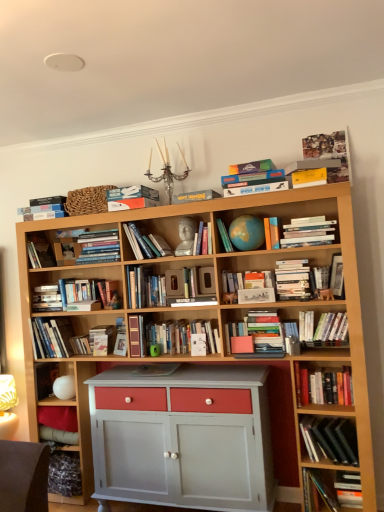
The image size is (384, 512). What do you see at coordinates (257, 335) in the screenshot?
I see `hardcover books at center, which is counted as the eighth book, starting from the left` at bounding box center [257, 335].

This screenshot has width=384, height=512. What do you see at coordinates (308, 233) in the screenshot? I see `hardcover books at upper center, the 4th book viewed from the right` at bounding box center [308, 233].

Measure the distance between hardcover book at lower right, which is the 13th book in left-to-right order, and camera.

hardcover book at lower right, which is the 13th book in left-to-right order, and camera are 8.03 feet apart.

Describe the element at coordinates (252, 167) in the screenshot. The width and height of the screenshot is (384, 512). I see `hardcover book at upper center, placed as the 4th paperback book when sorted from bottom to top` at that location.

Describe the element at coordinates (272, 233) in the screenshot. I see `hardcover book at upper center, the 9th book in the left-to-right sequence` at that location.

This screenshot has width=384, height=512. Identify the location of hardcover books at center, which is counted as the eighth book, starting from the left. (257, 335).

Is hardcover book at upper center, the 9th book in the left-to-right sequence, positioned behind hardcover books at upper center, the tenth book viewed from the left?

Yes, it is.

In terms of size, does hardcover book at upper center, the 9th book in the left-to-right sequence, appear bigger or smaller than hardcover books at upper center, the tenth book viewed from the left?

Considering their sizes, hardcover book at upper center, the 9th book in the left-to-right sequence, takes up less space than hardcover books at upper center, the tenth book viewed from the left.

From the image's perspective, is hardcover book at upper center, the fifth book in the right-to-left sequence, beneath hardcover books at upper center, the tenth book viewed from the left?

Yes, from the image's perspective, hardcover book at upper center, the fifth book in the right-to-left sequence, is beneath hardcover books at upper center, the tenth book viewed from the left.

From the image's perspective, between yellow matte paperback book at upper right, which is the 4th paperback book in left-to-right order, and white matte paperback book at center-right, the second paperback book positioned from the right, who is located below?

white matte paperback book at center-right, the second paperback book positioned from the right, is shown below in the image.

How different are the orientations of yellow matte paperback book at upper right, acting as the second paperback book starting from the top, and white matte paperback book at center-right, the second paperback book positioned from the right, in degrees?

The angle between the facing direction of yellow matte paperback book at upper right, acting as the second paperback book starting from the top, and the facing direction of white matte paperback book at center-right, the second paperback book positioned from the right, is 1.63 degrees.

From a real-world perspective, does yellow matte paperback book at upper right, acting as the second paperback book starting from the top, sit lower than white matte paperback book at center-right, the third paperback book in the left-to-right sequence?

Actually, yellow matte paperback book at upper right, acting as the second paperback book starting from the top, is physically above white matte paperback book at center-right, the third paperback book in the left-to-right sequence, in the real world.

Locate an element on the screen. The width and height of the screenshot is (384, 512). the 2nd paperback book in front of the white matte paperback book at center-right, which is counted as the fourth paperback book, starting from the top is located at coordinates (309, 177).

How distant is yellow matte paperback book at upper right, acting as the third paperback book starting from the bottom, from hardcover book at lower right, the first book positioned from the right?

yellow matte paperback book at upper right, acting as the third paperback book starting from the bottom, and hardcover book at lower right, the first book positioned from the right, are 5.96 feet apart.

Considering the sizes of yellow matte paperback book at upper right, the first paperback book viewed from the right, and hardcover book at lower right, the first book positioned from the right, in the image, is yellow matte paperback book at upper right, the first paperback book viewed from the right, taller or shorter than hardcover book at lower right, the first book positioned from the right,?

yellow matte paperback book at upper right, the first paperback book viewed from the right, is shorter than hardcover book at lower right, the first book positioned from the right.

From a real-world perspective, is yellow matte paperback book at upper right, the first paperback book viewed from the right, physically located above or below hardcover book at lower right, the first book positioned from the right?

In terms of real-world spatial position, yellow matte paperback book at upper right, the first paperback book viewed from the right, is above hardcover book at lower right, the first book positioned from the right.

Consider the image. From the image's perspective, is yellow matte paperback book at upper right, acting as the second paperback book starting from the top, positioned above or below hardcover book at lower right, the first book positioned from the right?

From the image's perspective, yellow matte paperback book at upper right, acting as the second paperback book starting from the top, appears above hardcover book at lower right, the first book positioned from the right.

Which point is more forward, (303, 386) or (238, 169)?

The point (303, 386) is closer.

Who is shorter, hardcover books at center, the 11th book from the left, or hardcover book at upper center, acting as the 3th paperback book starting from the right?

Standing shorter between the two is hardcover book at upper center, acting as the 3th paperback book starting from the right.

Between point (102, 230) and point (287, 284), which one is positioned in front?

The point (287, 284) is in front.

Is hardcover books at center, which is counted as the 4th book, starting from the left, bigger than white matte paperback book at center-right, which is counted as the fourth paperback book, starting from the top?

Indeed, hardcover books at center, which is counted as the 4th book, starting from the left, has a larger size compared to white matte paperback book at center-right, which is counted as the fourth paperback book, starting from the top.

From the image's perspective, would you say hardcover books at center, the tenth book when ordered from right to left, is shown under white matte paperback book at center-right, the second paperback book positioned from the right?

Actually, hardcover books at center, the tenth book when ordered from right to left, appears above white matte paperback book at center-right, the second paperback book positioned from the right, in the image.

Can you confirm if hardcover books at center, which is counted as the 4th book, starting from the left, is taller than white matte paperback book at center-right, which is counted as the fourth paperback book, starting from the top?

No, hardcover books at center, which is counted as the 4th book, starting from the left, is not taller than white matte paperback book at center-right, which is counted as the fourth paperback book, starting from the top.

Is hardcover books at center, arranged as the sixth book when viewed from the right, facing towards hardcover book at left, placed as the thirteenth book when sorted from right to left?

No, hardcover books at center, arranged as the sixth book when viewed from the right, does not turn towards hardcover book at left, placed as the thirteenth book when sorted from right to left.

Does point (277, 336) come closer to viewer compared to point (33, 251)?

Yes, it is in front of point (33, 251).

Between hardcover books at center, arranged as the sixth book when viewed from the right, and hardcover book at left, which is the first book from left to right, which one appears on the left side from the viewer's perspective?

hardcover book at left, which is the first book from left to right.

In the scene shown: Is hardcover book at upper center, the 9th book in the left-to-right sequence, located outside black matte book at lower right, the second book positioned from the right?

Yes, hardcover book at upper center, the 9th book in the left-to-right sequence, is outside of black matte book at lower right, the second book positioned from the right.

From the picture: Is hardcover book at upper center, the fifth book in the right-to-left sequence, beside black matte book at lower right, the second book positioned from the right?

No, hardcover book at upper center, the fifth book in the right-to-left sequence, is not making contact with black matte book at lower right, the second book positioned from the right.

Is hardcover book at upper center, the fifth book in the right-to-left sequence, turned away from black matte book at lower right, the second book positioned from the right?

No, hardcover book at upper center, the fifth book in the right-to-left sequence, is not facing the opposite direction of black matte book at lower right, the second book positioned from the right.

Between hardcover book at upper center, the fifth book in the right-to-left sequence, and black matte book at lower right, the second book positioned from the right, which one has smaller width?

With smaller width is hardcover book at upper center, the fifth book in the right-to-left sequence.

The image size is (384, 512). In order to click on the 1st book positioned above the hardcover books at upper center, the tenth book viewed from the left (from a real-world perspective) in this screenshot , I will do `click(272, 233)`.

What are the coordinates of `paperback book on the right side of white matte paperback book at center-right, which is counted as the fourth paperback book, starting from the top` in the screenshot? It's located at (309, 177).

Which object lies nearer to the anchor point hardcover books at center, which is counted as the eighth book, starting from the left, hardcover book at lower right, which is the 13th book in left-to-right order, or matte blue globe at center, which appears as the 7th book when viewed from the left?

matte blue globe at center, which appears as the 7th book when viewed from the left, is closer to hardcover books at center, which is counted as the eighth book, starting from the left.

From the image, which object appears to be farther from yellow matte paperback book at upper right, the first paperback book viewed from the right, hardcover book at center, marked as the eighth book in a right-to-left arrangement, or hardcover books at center, acting as the ninth book starting from the right?

hardcover books at center, acting as the ninth book starting from the right, is positioned further to the anchor yellow matte paperback book at upper right, the first paperback book viewed from the right.

When comparing their distances from hardcover books at upper center, the 4th book viewed from the right, does hardcover books at center, the 11th book from the left, or hardcover book at upper center, acting as the 3th paperback book starting from the right, seem closer?

The object closer to hardcover books at upper center, the 4th book viewed from the right, is hardcover book at upper center, acting as the 3th paperback book starting from the right.

Estimate the real-world distances between objects in this image. Which object is further from white matte paperback book at center-right, the second paperback book positioned from the right, hardcover book at center, marked as the 4th paperback book in a right-to-left arrangement, or hardcover book at center, marked as the eighth book in a right-to-left arrangement?

The object further to white matte paperback book at center-right, the second paperback book positioned from the right, is hardcover book at center, marked as the 4th paperback book in a right-to-left arrangement.

Which object lies nearer to the anchor point hardcover books at left, which is the eleventh book in right-to-left order, hardcover books at center, which is counted as the 4th book, starting from the left, or yellow matte paperback book at upper right, which is the 4th paperback book in left-to-right order?

Based on the image, hardcover books at center, which is counted as the 4th book, starting from the left, appears to be nearer to hardcover books at left, which is the eleventh book in right-to-left order.

Estimate the real-world distances between objects in this image. Which object is closer to hardcover book at lower right, the first book positioned from the right, black matte book at lower right, the second book positioned from the right, or hardcover books at center, arranged as the sixth book when viewed from the right?

Based on the image, black matte book at lower right, the second book positioned from the right, appears to be nearer to hardcover book at lower right, the first book positioned from the right.

Based on their spatial positions, is hardcover book at upper center, which ranks as the first paperback book in top-to-bottom order, or hardcover book at lower right, the first book positioned from the right, further from hardcover book at upper center, the 9th book in the left-to-right sequence?

Among the two, hardcover book at lower right, the first book positioned from the right, is located further to hardcover book at upper center, the 9th book in the left-to-right sequence.

Looking at the image, which one is located further to hardcover books at center, acting as the ninth book starting from the right, hardcover book at upper center, acting as the 3th paperback book starting from the right, or hardcover books at left, positioned as the 3th book in left-to-right order?

hardcover book at upper center, acting as the 3th paperback book starting from the right, lies further to hardcover books at center, acting as the ninth book starting from the right, than the other object.

Image resolution: width=384 pixels, height=512 pixels. Find the location of `paperback book between hardcover book at center, which is counted as the sixth book, starting from the left, and black matte book at lower right, the second book positioned from the right, in the vertical direction`. paperback book between hardcover book at center, which is counted as the sixth book, starting from the left, and black matte book at lower right, the second book positioned from the right, in the vertical direction is located at coordinates (292, 279).

What are the coordinates of `paperback book between hardcover books at upper center, the 4th book viewed from the right, and hardcover books at center, arranged as the sixth book when viewed from the right, vertically` in the screenshot? It's located at (292, 279).

At what (x,y) coordinates should I click in order to perform the action: click on paperback book between hardcover book at center, which is the first paperback book in left-to-right order, and hardcover book at upper center, the fifth book in the right-to-left sequence. Please return your answer as a coordinate pair (x, y). The height and width of the screenshot is (512, 384). Looking at the image, I should click on (252, 167).

Identify the location of paperback book between hardcover book at upper center, the fifth book in the right-to-left sequence, and hardcover book at lower right, the first book positioned from the right, from top to bottom. (292, 279).